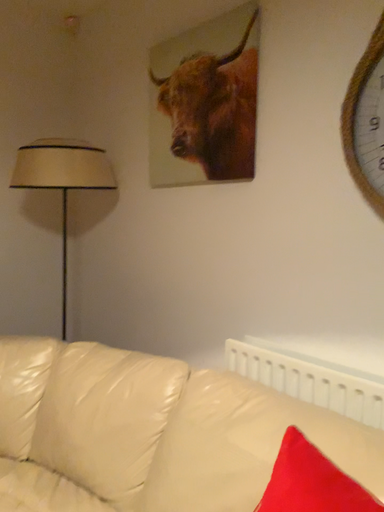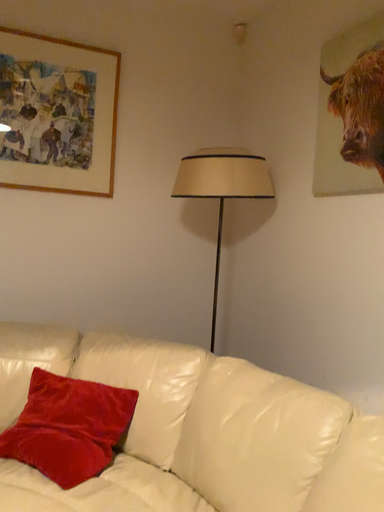
Question: Which way did the camera rotate in the video?

Choices:
 (A) rotated left
 (B) rotated right

Answer: (A)